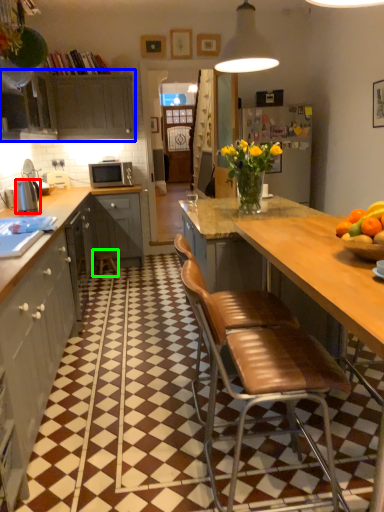
Question: Which object is positioned closest to kitchen appliance (highlighted by a red box)? Select from cabinetry (highlighted by a blue box) and bar stool (highlighted by a green box).

Choices:
 (A) cabinetry
 (B) bar stool

Answer: (B)